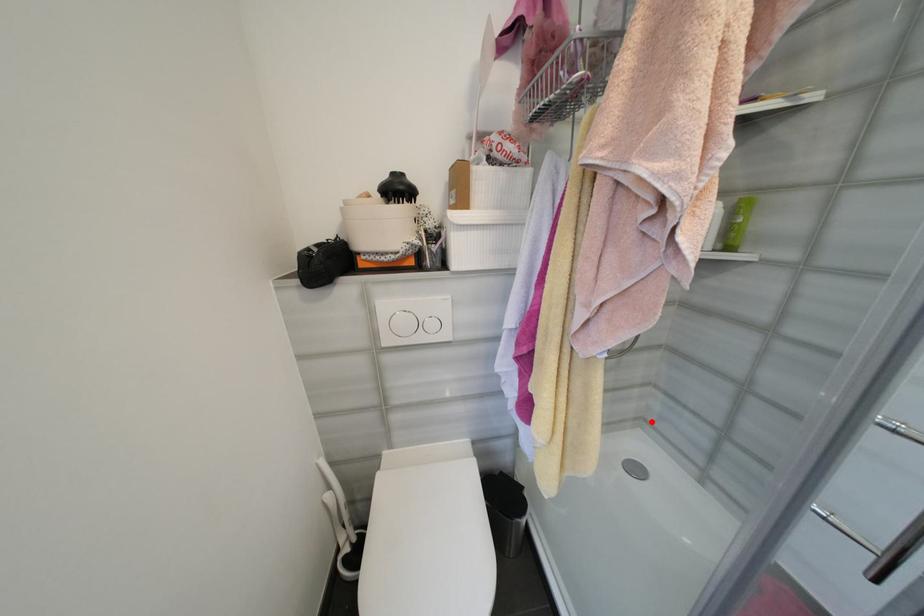
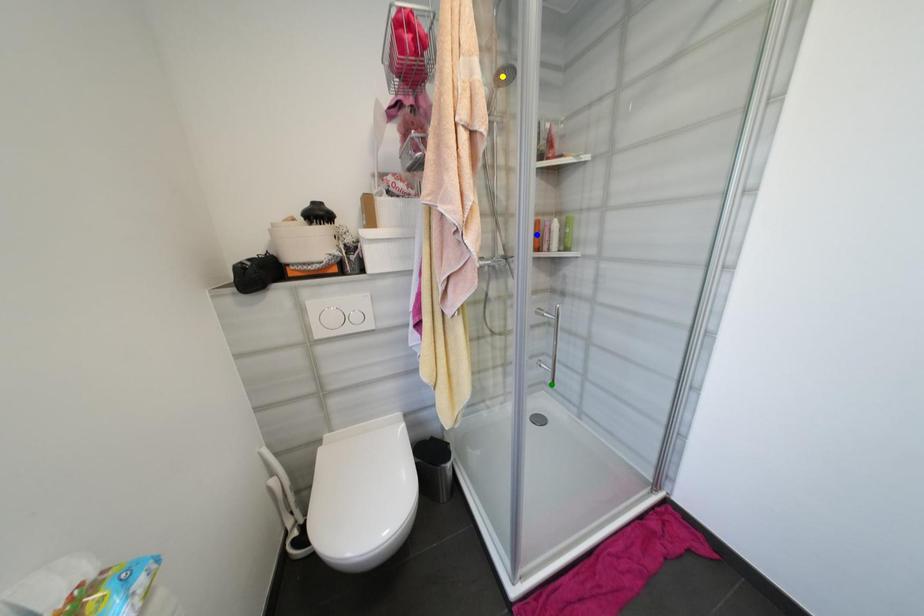
Question: I am providing you with two images of the same scene from different viewpoints. A red point is marked on the first image. You are given multiple points on the second image. Which mark in image 2 goes with the point in image 1?

Choices:
 (A) blue point
 (B) green point
 (C) yellow point

Answer: (B)